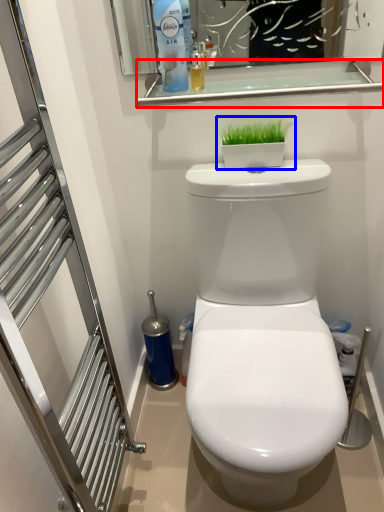
Question: Which object is further to the camera taking this photo, balustrade (highlighted by a red box) or houseplant (highlighted by a blue box)?

Choices:
 (A) balustrade
 (B) houseplant

Answer: (B)